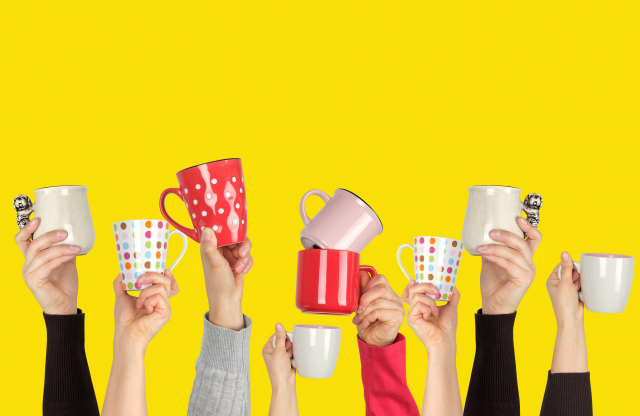
You are a GUI agent. You are given a task and a screenshot of the screen. Output one action in this format:
    pyautogui.click(x=<x>, y=<y>)
    Task: Click on the cup handle
    The image size is (640, 416).
    Given the screenshot: What is the action you would take?
    pyautogui.click(x=164, y=205), pyautogui.click(x=184, y=247), pyautogui.click(x=22, y=209), pyautogui.click(x=289, y=331), pyautogui.click(x=317, y=192), pyautogui.click(x=369, y=265), pyautogui.click(x=400, y=252), pyautogui.click(x=531, y=211), pyautogui.click(x=578, y=261)